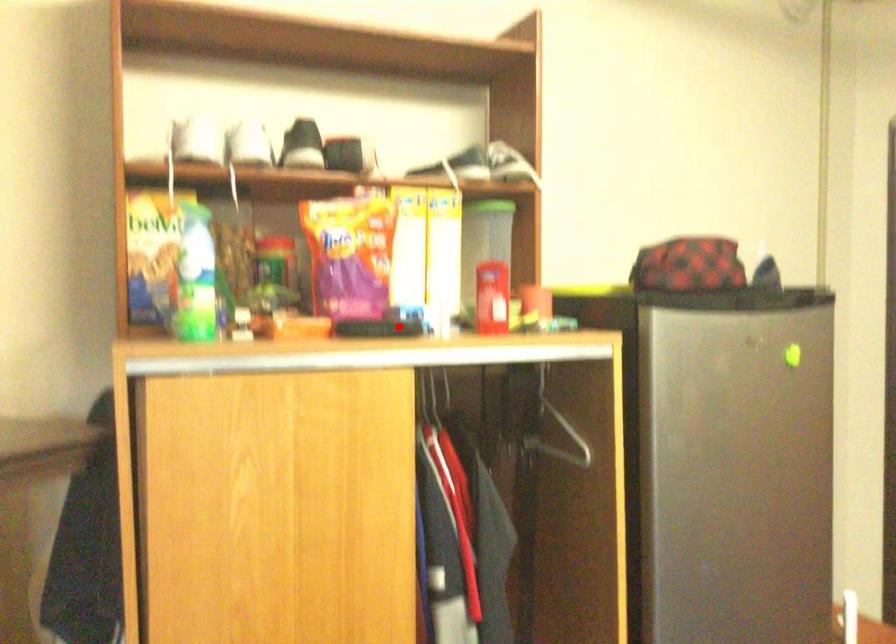
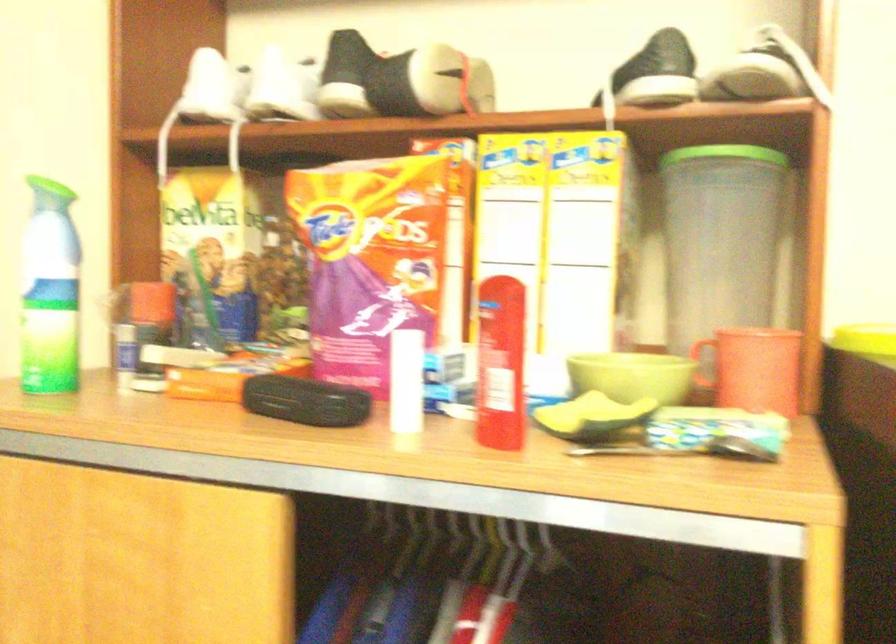
Question: I am providing you with two images of the same scene from different viewpoints. A red point is shown in image1. For the corresponding object point in image2, is it positioned nearer or farther from the camera?

Choices:
 (A) Nearer
 (B) Farther

Answer: (A)